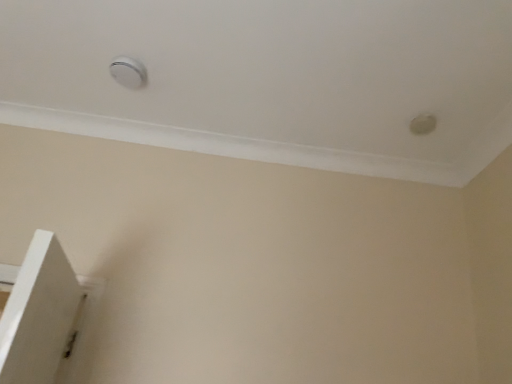
This screenshot has width=512, height=384. What do you see at coordinates (423, 124) in the screenshot?
I see `white plastic knob at upper right, arranged as the first knob when ordered from the bottom` at bounding box center [423, 124].

How much space does white plastic knob at upper right, arranged as the first knob when ordered from the bottom, occupy horizontally?

3.99 inches.

I want to click on white plastic knob at upper right, arranged as the first knob when ordered from the bottom, so click(x=423, y=124).

This screenshot has height=384, width=512. What do you see at coordinates (128, 72) in the screenshot?
I see `white plastic knob at upper center, which is counted as the second knob, starting from the bottom` at bounding box center [128, 72].

What are the coordinates of `white plastic knob at upper center, the 1th knob viewed from the top` in the screenshot? It's located at (128, 72).

Measure the distance between point [114,62] and camera.

5.66 feet.

What are the coordinates of `white plastic knob at upper right, which is the 1th knob from right to left` in the screenshot? It's located at (423, 124).

Visually, is white plastic knob at upper right, which is the 2th knob from top to bottom, positioned to the left or to the right of white plastic knob at upper center, the 1th knob viewed from the top?

Clearly, white plastic knob at upper right, which is the 2th knob from top to bottom, is on the right of white plastic knob at upper center, the 1th knob viewed from the top, in the image.

In the image, is white plastic knob at upper right, arranged as the first knob when ordered from the bottom, positioned in front of or behind white plastic knob at upper center, which is counted as the second knob, starting from the bottom?

white plastic knob at upper right, arranged as the first knob when ordered from the bottom, is positioned farther from the viewer than white plastic knob at upper center, which is counted as the second knob, starting from the bottom.

Is point (423, 116) closer to viewer compared to point (118, 62)?

No, it is not.

From the image's perspective, is white plastic knob at upper right, which is the 1th knob from right to left, located beneath white plastic knob at upper center, which is counted as the second knob, starting from the bottom?

Yes.

From a real-world perspective, relative to white plastic knob at upper center, which is counted as the second knob, starting from the bottom, is white plastic knob at upper right, which is the 2th knob from top to bottom, vertically above or below?

white plastic knob at upper right, which is the 2th knob from top to bottom, is above white plastic knob at upper center, which is counted as the second knob, starting from the bottom.

Is white plastic knob at upper right, arranged as the first knob when ordered from the bottom, thinner than white plastic knob at upper center, the 2th knob positioned from the right?

Correct, the width of white plastic knob at upper right, arranged as the first knob when ordered from the bottom, is less than that of white plastic knob at upper center, the 2th knob positioned from the right.

Between white plastic knob at upper right, which is the 2th knob from top to bottom, and white plastic knob at upper center, the 2th knob positioned from the right, which one has less height?

Standing shorter between the two is white plastic knob at upper right, which is the 2th knob from top to bottom.

Is white plastic knob at upper right, which is the second knob from left to right, smaller than white plastic knob at upper center, the 1th knob from the left?

Indeed, white plastic knob at upper right, which is the second knob from left to right, has a smaller size compared to white plastic knob at upper center, the 1th knob from the left.

Can white plastic knob at upper center, which is counted as the second knob, starting from the bottom, be found inside white plastic knob at upper right, which is the 2th knob from top to bottom?

No, white plastic knob at upper center, which is counted as the second knob, starting from the bottom, is not surrounded by white plastic knob at upper right, which is the 2th knob from top to bottom.

Is white plastic knob at upper right, arranged as the first knob when ordered from the bottom, touching white plastic knob at upper center, the 1th knob viewed from the top?

There is a gap between white plastic knob at upper right, arranged as the first knob when ordered from the bottom, and white plastic knob at upper center, the 1th knob viewed from the top.

Is white plastic knob at upper right, which is the 2th knob from top to bottom, oriented away from white plastic knob at upper center, the 1th knob viewed from the top?

No, white plastic knob at upper center, the 1th knob viewed from the top, is not at the back of white plastic knob at upper right, which is the 2th knob from top to bottom.

Measure the distance from white plastic knob at upper right, arranged as the first knob when ordered from the bottom, to white plastic knob at upper center, the 1th knob from the left.

white plastic knob at upper right, arranged as the first knob when ordered from the bottom, and white plastic knob at upper center, the 1th knob from the left, are 1.20 meters apart.

I want to click on knob that is below the white plastic knob at upper center, which is counted as the second knob, starting from the bottom (from the image's perspective), so coord(423,124).

Based on their positions, is white plastic knob at upper center, the 1th knob from the left, located to the left or right of white plastic knob at upper right, which is the second knob from left to right?

In the image, white plastic knob at upper center, the 1th knob from the left, appears on the left side of white plastic knob at upper right, which is the second knob from left to right.

Is white plastic knob at upper center, the 1th knob from the left, closer to the viewer compared to white plastic knob at upper right, arranged as the first knob when ordered from the bottom?

Yes, the depth of white plastic knob at upper center, the 1th knob from the left, is less than that of white plastic knob at upper right, arranged as the first knob when ordered from the bottom.

Which is more distant, [126,73] or [429,131]?

The point [429,131] is farther.

Based on the photo, from the image's perspective, is white plastic knob at upper center, the 1th knob viewed from the top, located above white plastic knob at upper right, which is the 1th knob from right to left?

Yes.

From a real-world perspective, is white plastic knob at upper center, the 1th knob viewed from the top, on top of white plastic knob at upper right, which is the second knob from left to right?

No.

Considering the sizes of objects white plastic knob at upper center, which is counted as the second knob, starting from the bottom, and white plastic knob at upper right, which is the 1th knob from right to left, in the image provided, who is thinner, white plastic knob at upper center, which is counted as the second knob, starting from the bottom, or white plastic knob at upper right, which is the 1th knob from right to left,?

→ white plastic knob at upper right, which is the 1th knob from right to left.

From the picture: Considering the relative sizes of white plastic knob at upper center, the 1th knob viewed from the top, and white plastic knob at upper right, which is the 2th knob from top to bottom, in the image provided, is white plastic knob at upper center, the 1th knob viewed from the top, taller than white plastic knob at upper right, which is the 2th knob from top to bottom,?

Yes.

Considering the relative sizes of white plastic knob at upper center, the 1th knob viewed from the top, and white plastic knob at upper right, which is the 2th knob from top to bottom, in the image provided, is white plastic knob at upper center, the 1th knob viewed from the top, bigger than white plastic knob at upper right, which is the 2th knob from top to bottom,?

Yes, white plastic knob at upper center, the 1th knob viewed from the top, is bigger than white plastic knob at upper right, which is the 2th knob from top to bottom.

Is white plastic knob at upper right, arranged as the first knob when ordered from the bottom, completely or partially inside white plastic knob at upper center, the 1th knob from the left?

No, white plastic knob at upper right, arranged as the first knob when ordered from the bottom, is located outside of white plastic knob at upper center, the 1th knob from the left.

Are white plastic knob at upper center, which is counted as the second knob, starting from the bottom, and white plastic knob at upper right, arranged as the first knob when ordered from the bottom, located far from each other?

white plastic knob at upper center, which is counted as the second knob, starting from the bottom, is far away from white plastic knob at upper right, arranged as the first knob when ordered from the bottom.

Is white plastic knob at upper center, the 2th knob positioned from the right, facing away from white plastic knob at upper right, which is the second knob from left to right?

No, white plastic knob at upper center, the 2th knob positioned from the right, is not facing the opposite direction of white plastic knob at upper right, which is the second knob from left to right.

Can you tell me how much white plastic knob at upper center, the 2th knob positioned from the right, and white plastic knob at upper right, arranged as the first knob when ordered from the bottom, differ in facing direction?

The facing directions of white plastic knob at upper center, the 2th knob positioned from the right, and white plastic knob at upper right, arranged as the first knob when ordered from the bottom, are 180 degrees apart.

Measure the distance between white plastic knob at upper center, the 1th knob from the left, and white plastic knob at upper right, which is the second knob from left to right.

They are 1.20 meters apart.

The image size is (512, 384). In order to click on knob below the white plastic knob at upper right, which is the 1th knob from right to left (from a real-world perspective) in this screenshot , I will do `click(128, 72)`.

There is a white plastic knob at upper center, the 1th knob from the left. What are the coordinates of `knob above it (from a real-world perspective)` in the screenshot? It's located at (423, 124).

The image size is (512, 384). Identify the location of knob behind the white plastic knob at upper center, the 1th knob viewed from the top. [423, 124].